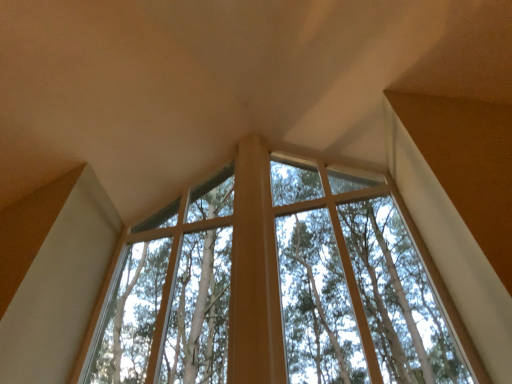
What do you see at coordinates (279, 286) in the screenshot? The image size is (512, 384). I see `clear glass window at center` at bounding box center [279, 286].

You are a GUI agent. You are given a task and a screenshot of the screen. Output one action in this format:
    pyautogui.click(x=<x>, y=<y>)
    Task: Click on the clear glass window at center
    
    Given the screenshot: What is the action you would take?
    pyautogui.click(x=279, y=286)

Where is `clear glass window at center`? The width and height of the screenshot is (512, 384). clear glass window at center is located at coordinates (279, 286).